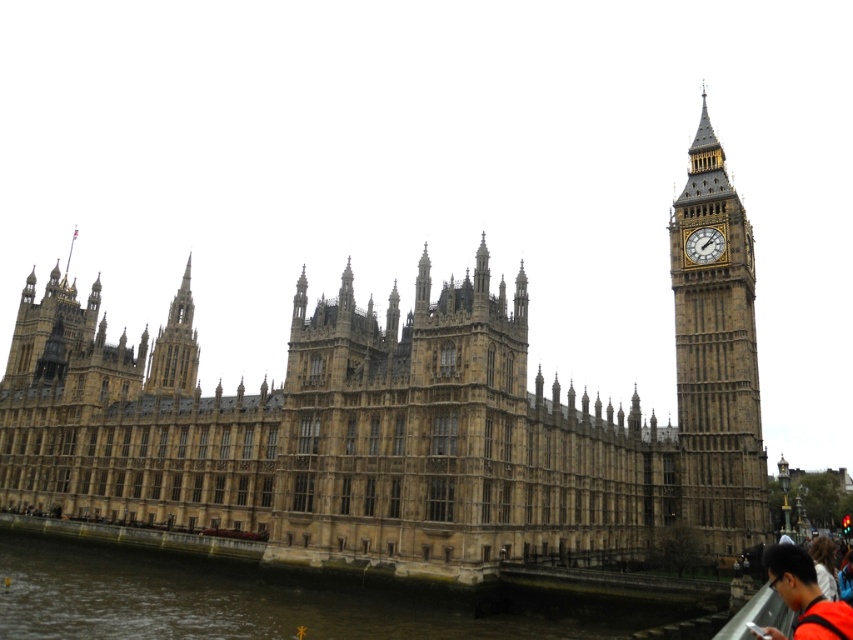
Question: Which object is positioned farthest from the gold metallic clock at right?

Choices:
 (A) golden stone spire at upper left
 (B) brown stone castle at center
 (C) brown water at lower left

Answer: (A)

Question: Which point is closer to the camera?

Choices:
 (A) brown water at lower left
 (B) orange fabric shirt at lower right
 (C) golden stone spire at upper left

Answer: (B)

Question: Can you confirm if brown stone castle at center is smaller than orange fabric shirt at lower right?

Choices:
 (A) no
 (B) yes

Answer: (A)

Question: Is golden stone spire at upper left above gold metallic clock at right?

Choices:
 (A) yes
 (B) no

Answer: (B)

Question: Among these objects, which one is farthest from the camera?

Choices:
 (A) brown stone castle at center
 (B) golden stone spire at upper left
 (C) gold metallic clock at right

Answer: (B)

Question: Does brown stone castle at center have a lesser width compared to gold metallic clock at right?

Choices:
 (A) no
 (B) yes

Answer: (A)